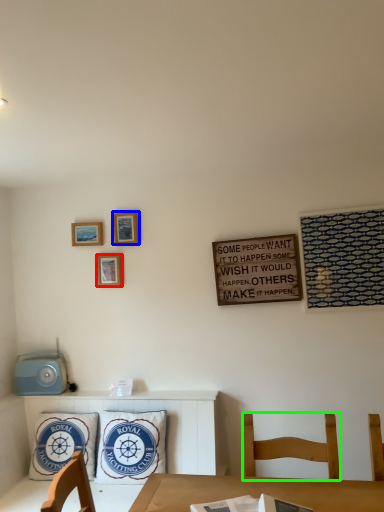
Question: Estimate the real-world distances between objects in this image. Which object is closer to picture frame (highlighted by a red box), picture frame (highlighted by a blue box) or chair (highlighted by a green box)?

Choices:
 (A) picture frame
 (B) chair

Answer: (A)